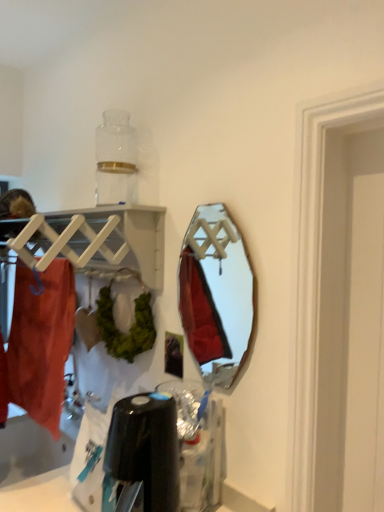
The width and height of the screenshot is (384, 512). Identify the location of white matte wooden shelf at upper left. (92, 240).

This screenshot has width=384, height=512. What do you see at coordinates (216, 294) in the screenshot? I see `metallic silver mirror at center` at bounding box center [216, 294].

Where is `white matte wooden shelf at upper left`? The width and height of the screenshot is (384, 512). white matte wooden shelf at upper left is located at coordinates (92, 240).

Looking at this image, can you tell me how much metallic silver mirror at center and white matte wooden shelf at upper left differ in facing direction?

The angular difference between metallic silver mirror at center and white matte wooden shelf at upper left is 1.21 degrees.

From the image's perspective, is metallic silver mirror at center on top of white matte wooden shelf at upper left?

No, from the image's perspective, metallic silver mirror at center is not above white matte wooden shelf at upper left.

Looking at the image, does metallic silver mirror at center seem bigger or smaller compared to white matte wooden shelf at upper left?

Clearly, metallic silver mirror at center is smaller in size than white matte wooden shelf at upper left.

Which of these two, metallic silver mirror at center or white matte wooden shelf at upper left, stands taller?

Standing taller between the two is metallic silver mirror at center.

Looking at this image, considering the positions of objects matte orange towel at left and metallic silver mirror at center in the image provided, who is in front, matte orange towel at left or metallic silver mirror at center?

metallic silver mirror at center is closer to the camera.

Based on their sizes in the image, would you say matte orange towel at left is bigger or smaller than metallic silver mirror at center?

matte orange towel at left is bigger than metallic silver mirror at center.

Are matte orange towel at left and metallic silver mirror at center located far from each other?

No, matte orange towel at left is not far away from metallic silver mirror at center.

The height and width of the screenshot is (512, 384). In order to click on clothing beneath the metallic silver mirror at center (from a real-world perspective) in this screenshot , I will do pos(41,342).

Is the position of matte orange towel at left more distant than that of white matte wooden shelf at upper left?

Yes.

From the image's perspective, does matte orange towel at left appear lower than white matte wooden shelf at upper left?

Correct, matte orange towel at left appears lower than white matte wooden shelf at upper left in the image.

Can you tell me how much matte orange towel at left and white matte wooden shelf at upper left differ in facing direction?

matte orange towel at left and white matte wooden shelf at upper left are facing 4.04 degrees away from each other.

Which object is positioned more to the right, matte orange towel at left or white matte wooden shelf at upper left?

white matte wooden shelf at upper left is more to the right.

Find the location of a particular element. shelf located above the metallic silver mirror at center (from the image's perspective) is located at coordinates (92, 240).

Is there a large distance between white matte wooden shelf at upper left and metallic silver mirror at center?

They are positioned close to each other.

Is metallic silver mirror at center inside white matte wooden shelf at upper left?

No, metallic silver mirror at center is not inside white matte wooden shelf at upper left.

Who is shorter, white matte wooden shelf at upper left or metallic silver mirror at center?

Standing shorter between the two is white matte wooden shelf at upper left.

From the image's perspective, which one is positioned higher, metallic silver mirror at center or matte orange towel at left?

metallic silver mirror at center, from the image's perspective.

Is metallic silver mirror at center positioned before matte orange towel at left?

Yes, it is in front of matte orange towel at left.

Could you tell me if white matte wooden shelf at upper left is turned towards matte orange towel at left?

Yes, white matte wooden shelf at upper left is aimed at matte orange towel at left.

Considering the relative sizes of white matte wooden shelf at upper left and matte orange towel at left in the image provided, is white matte wooden shelf at upper left bigger than matte orange towel at left?

No.

Which is behind, white matte wooden shelf at upper left or matte orange towel at left?

matte orange towel at left is more distant.

Which point is more forward, (124, 241) or (48, 342)?

Point (48, 342)

Locate an element on the screen. The height and width of the screenshot is (512, 384). shelf positioned vertically above the metallic silver mirror at center (from a real-world perspective) is located at coordinates (92, 240).

Where is `clothing below the metallic silver mirror at center (from a real-world perspective)`? clothing below the metallic silver mirror at center (from a real-world perspective) is located at coordinates (41, 342).

Which object lies nearer to the anchor point white matte wooden shelf at upper left, matte orange towel at left or metallic silver mirror at center?

matte orange towel at left.

Looking at the image, which one is located further to metallic silver mirror at center, white matte wooden shelf at upper left or matte orange towel at left?

matte orange towel at left lies further to metallic silver mirror at center than the other object.

Looking at the image, which one is located closer to matte orange towel at left, white matte wooden shelf at upper left or metallic silver mirror at center?

The object closer to matte orange towel at left is white matte wooden shelf at upper left.

Estimate the real-world distances between objects in this image. Which object is closer to metallic silver mirror at center, matte orange towel at left or white matte wooden shelf at upper left?

The object closer to metallic silver mirror at center is white matte wooden shelf at upper left.

Looking at the image, which one is located further to matte orange towel at left, metallic silver mirror at center or white matte wooden shelf at upper left?

metallic silver mirror at center is further to matte orange towel at left.

Estimate the real-world distances between objects in this image. Which object is closer to white matte wooden shelf at upper left, metallic silver mirror at center or matte orange towel at left?

matte orange towel at left.

The height and width of the screenshot is (512, 384). Find the location of `shelf located between matte orange towel at left and metallic silver mirror at center in the left-right direction`. shelf located between matte orange towel at left and metallic silver mirror at center in the left-right direction is located at coordinates (92, 240).